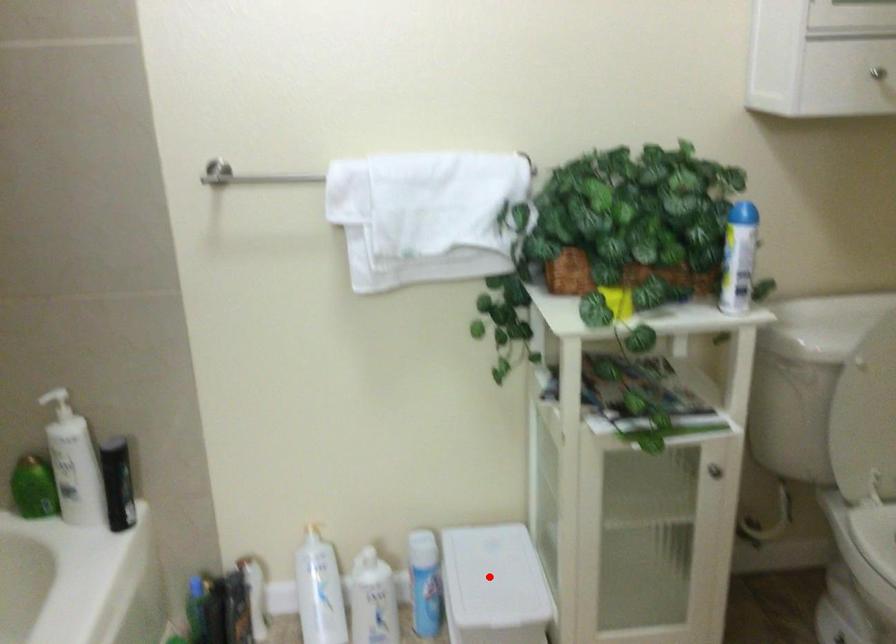
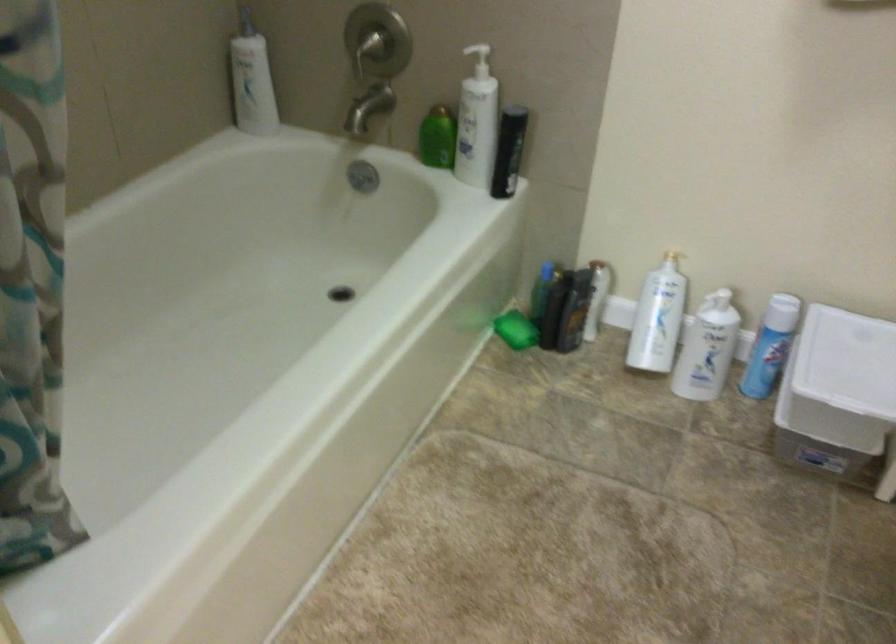
Locate, in the second image, the point that corresponds to the highlighted location in the first image.

(847, 361)